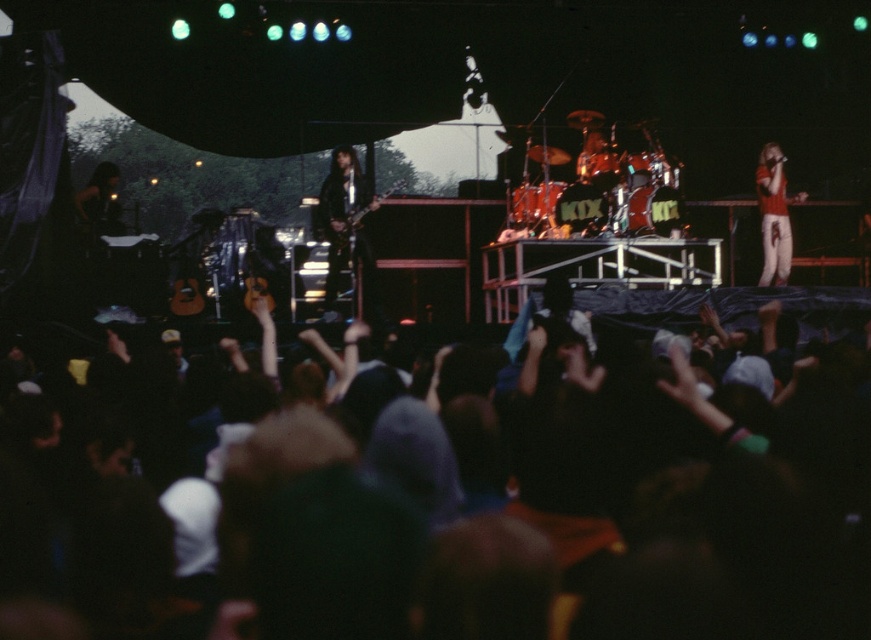
Question: Among these objects, which one is farthest from the camera?

Choices:
 (A) black fabric crowd at lower center
 (B) red matte shirt at right
 (C) shiny black guitar at center

Answer: (B)

Question: Can you confirm if black fabric crowd at lower center is smaller than red matte shirt at right?

Choices:
 (A) no
 (B) yes

Answer: (A)

Question: Does shiny red drum set at center come in front of black leather guitar at center?

Choices:
 (A) no
 (B) yes

Answer: (B)

Question: Which object is the closest to the black fabric crowd at lower center?

Choices:
 (A) shiny red drum set at center
 (B) red matte shirt at right
 (C) shiny black guitar at center

Answer: (A)

Question: Which is nearer to the red matte shirt at right?

Choices:
 (A) black leather guitar at center
 (B) shiny black guitar at center
 (C) black fabric crowd at lower center
 (D) shiny red drum set at center

Answer: (D)

Question: Can you confirm if black fabric crowd at lower center is positioned to the left of shiny red drum set at center?

Choices:
 (A) no
 (B) yes

Answer: (B)